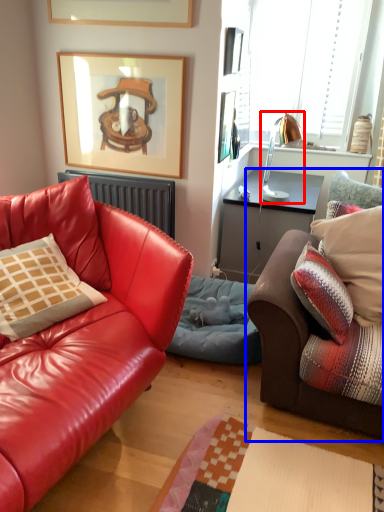
Question: Which object is closer to the camera taking this photo, lamp (highlighted by a red box) or studio couch (highlighted by a blue box)?

Choices:
 (A) lamp
 (B) studio couch

Answer: (B)